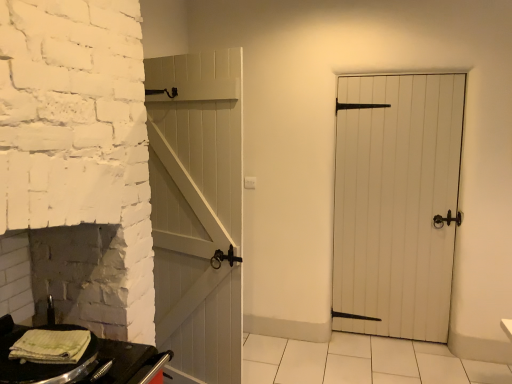
Question: Considering the relative sizes of black matte table at lower left and green striped towel at lower left in the image provided, is black matte table at lower left wider than green striped towel at lower left?

Choices:
 (A) no
 (B) yes

Answer: (B)

Question: From the image's perspective, is black matte table at lower left below green striped towel at lower left?

Choices:
 (A) yes
 (B) no

Answer: (A)

Question: Does black matte table at lower left have a smaller size compared to green striped towel at lower left?

Choices:
 (A) yes
 (B) no

Answer: (B)

Question: Is black matte table at lower left far from green striped towel at lower left?

Choices:
 (A) yes
 (B) no

Answer: (B)

Question: Does black matte table at lower left have a larger size compared to green striped towel at lower left?

Choices:
 (A) yes
 (B) no

Answer: (A)

Question: From a real-world perspective, is black matte table at lower left below green striped towel at lower left?

Choices:
 (A) no
 (B) yes

Answer: (B)

Question: Is green striped towel at lower left facing away from white wooden door at center?

Choices:
 (A) no
 (B) yes

Answer: (A)

Question: Is green striped towel at lower left surrounding white wooden door at center?

Choices:
 (A) yes
 (B) no

Answer: (B)

Question: From a real-world perspective, is green striped towel at lower left below white wooden door at center?

Choices:
 (A) yes
 (B) no

Answer: (A)

Question: Could you tell me if green striped towel at lower left is facing white wooden door at center?

Choices:
 (A) no
 (B) yes

Answer: (A)

Question: Is green striped towel at lower left behind white wooden door at center?

Choices:
 (A) no
 (B) yes

Answer: (A)

Question: Would you consider green striped towel at lower left to be distant from white wooden door at center?

Choices:
 (A) yes
 (B) no

Answer: (A)

Question: Is black matte table at lower left next to white wooden door at center?

Choices:
 (A) no
 (B) yes

Answer: (A)